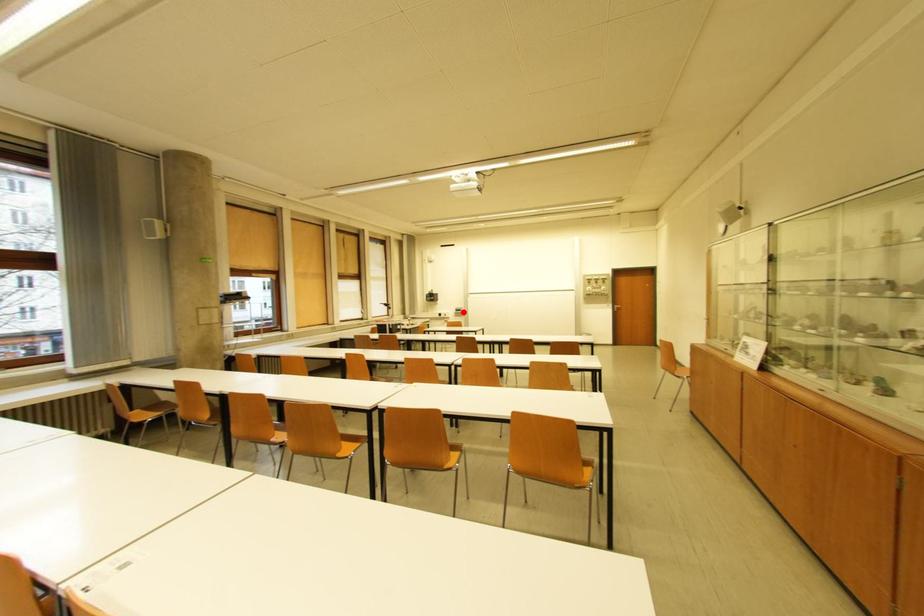
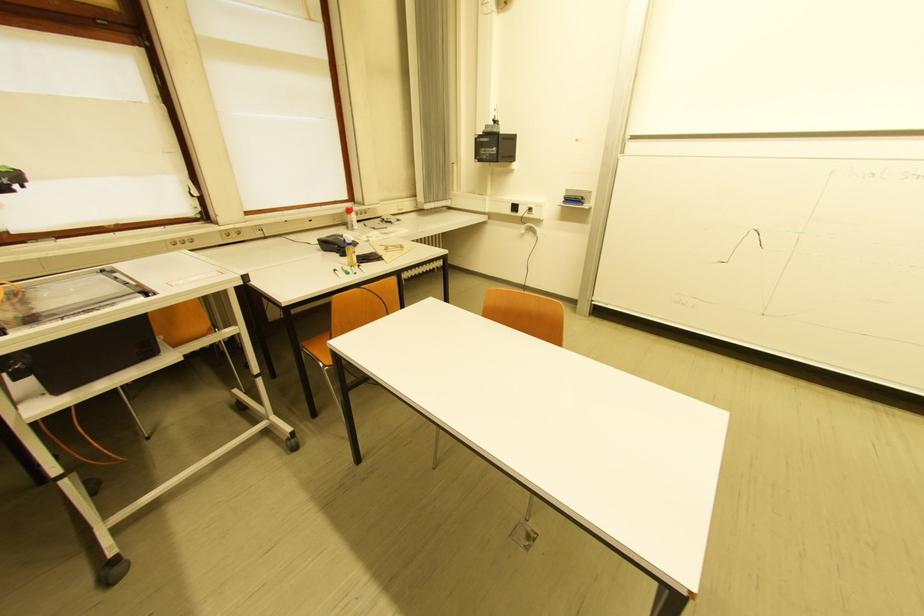
The point at the highlighted location is marked in the first image. Where is the corresponding point in the second image?

(575, 201)